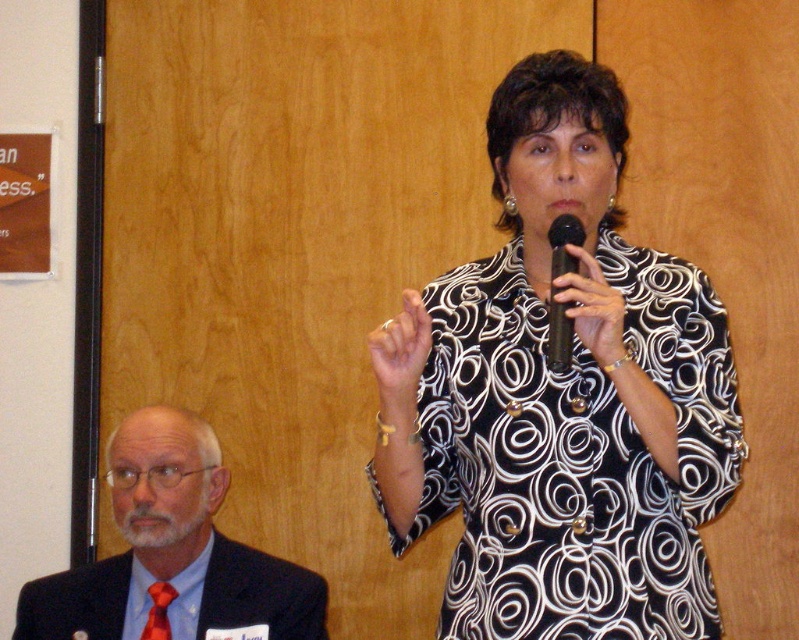
Question: Which point is closer to the camera taking this photo?

Choices:
 (A) (610, 636)
 (B) (235, 548)

Answer: (A)

Question: Does black printed dress at center lie in front of shiny red tie at lower left?

Choices:
 (A) yes
 (B) no

Answer: (A)

Question: Based on their relative distances, which object is farther from the black matte microphone at center?

Choices:
 (A) black printed dress at center
 (B) matte black suit at lower left

Answer: (B)

Question: Does black printed dress at center appear on the left side of black matte microphone at center?

Choices:
 (A) yes
 (B) no

Answer: (A)

Question: Which object is the closest to the shiny red tie at lower left?

Choices:
 (A) black printed dress at center
 (B) black matte microphone at center
 (C) matte black suit at lower left

Answer: (C)

Question: Does black printed dress at center have a smaller size compared to shiny red tie at lower left?

Choices:
 (A) yes
 (B) no

Answer: (B)